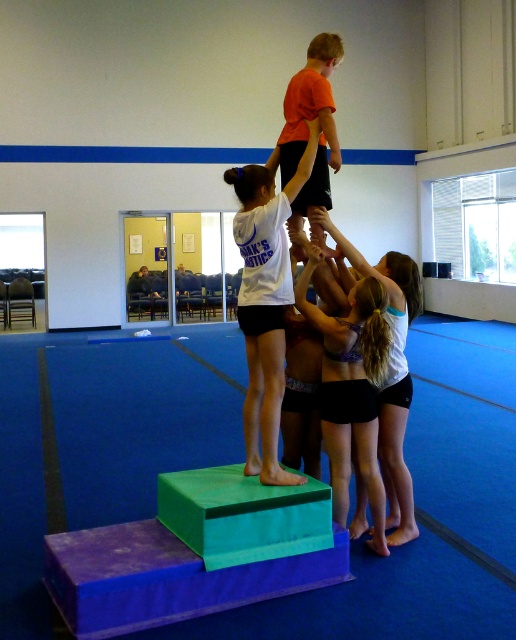
Question: Is purple fabric shorts at center positioned before orange matte shirt at upper center?

Choices:
 (A) no
 (B) yes

Answer: (B)

Question: Which of the following is the farthest from the observer?

Choices:
 (A) (277, 141)
 (B) (385, 300)

Answer: (A)

Question: Among these points, which one is nearest to the camera?

Choices:
 (A) (383, 528)
 (B) (327, 92)

Answer: (A)

Question: Among these points, which one is farthest from the camera?

Choices:
 (A) (326, 124)
 (B) (346, 497)

Answer: (A)

Question: Is white matte shirt at center positioned at the back of orange matte shirt at upper center?

Choices:
 (A) no
 (B) yes

Answer: (A)

Question: Does white matte shirt at center appear under purple fabric shorts at center?

Choices:
 (A) yes
 (B) no

Answer: (B)